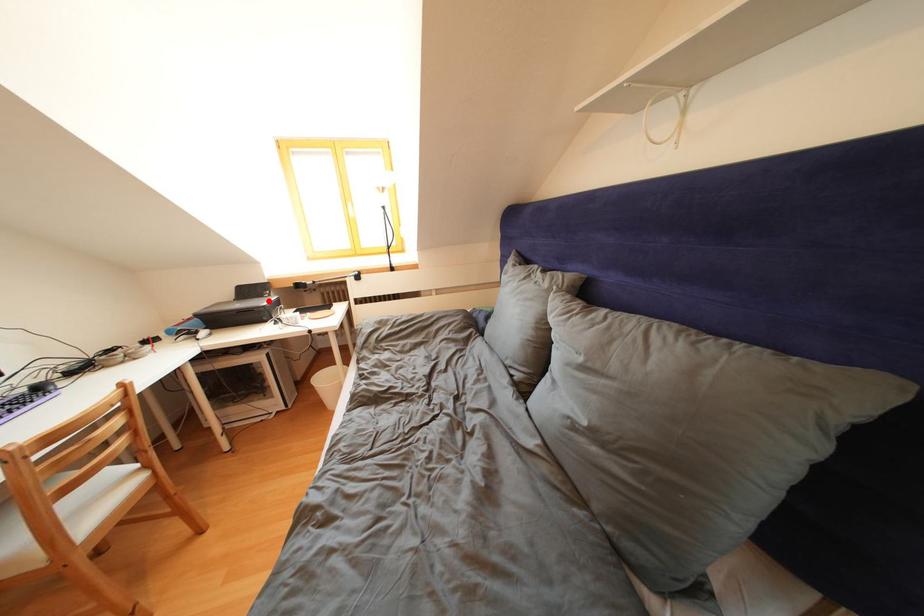
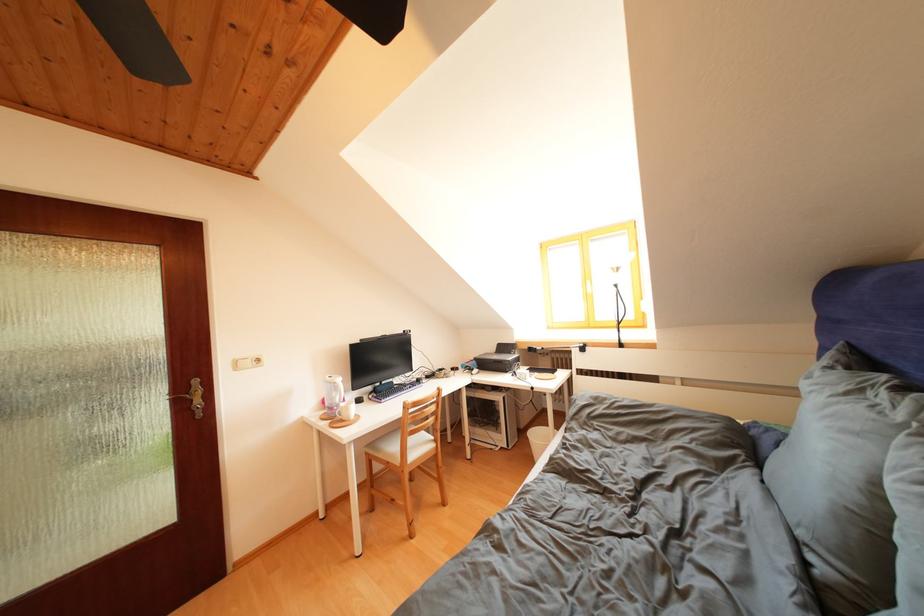
In the second image, find the point that corresponds to the highlighted location in the first image.

(517, 358)